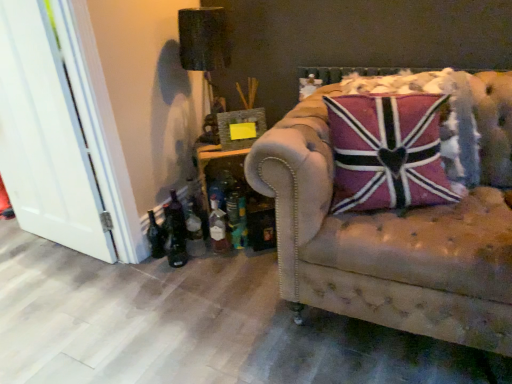
Where is `empty space that is to the right of translucent glass bottle at lower left, the 2th bottle in the left-to-right sequence`? empty space that is to the right of translucent glass bottle at lower left, the 2th bottle in the left-to-right sequence is located at coordinates (227, 257).